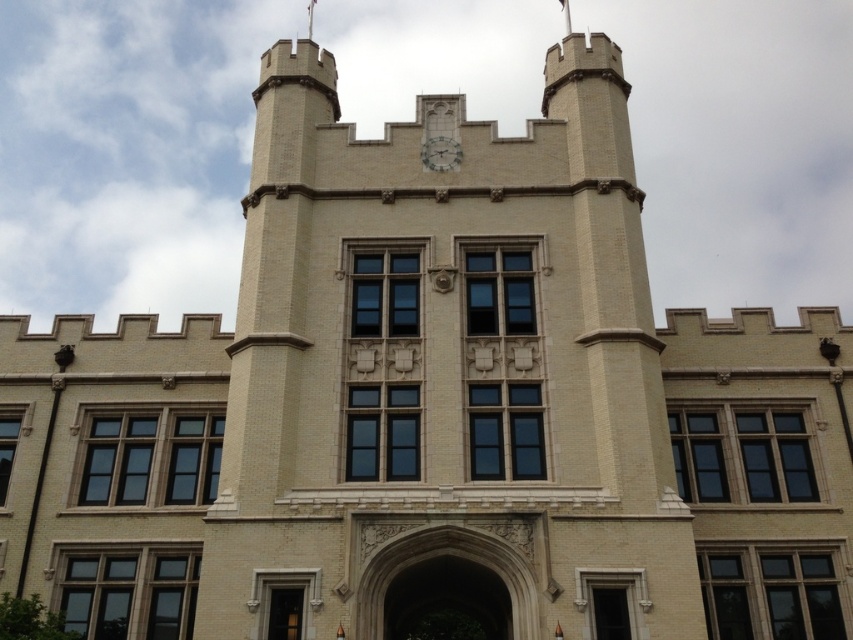
You are standing in front of the historic building and notice two points marked on the tower. The first point is at coordinates point (453, 152) and the second is at point (310, 4). From your perspective, which point appears closer to you?

Point (453, 152) is in front of point (310, 4), so it appears closer to you.

You are standing in front of the grand historic building and notice the white brick tower at center and the white glossy clock at center. Which object is positioned higher up on the building?

The white glossy clock at center is positioned higher up on the building than the white brick tower at center, as the clock is located above the tower.

You are an architect planning to add a new element to the building facade. You have a small decorative plaque that needs to be placed between the white glossy clock at center and the white fabric flag at upper center. Considering their sizes, where should you position the plaque to ensure it doesn

The white glossy clock at center is larger than the white fabric flag at upper center. To maintain balance, position the plaque closer to the smaller white fabric flag at upper center so it doesn